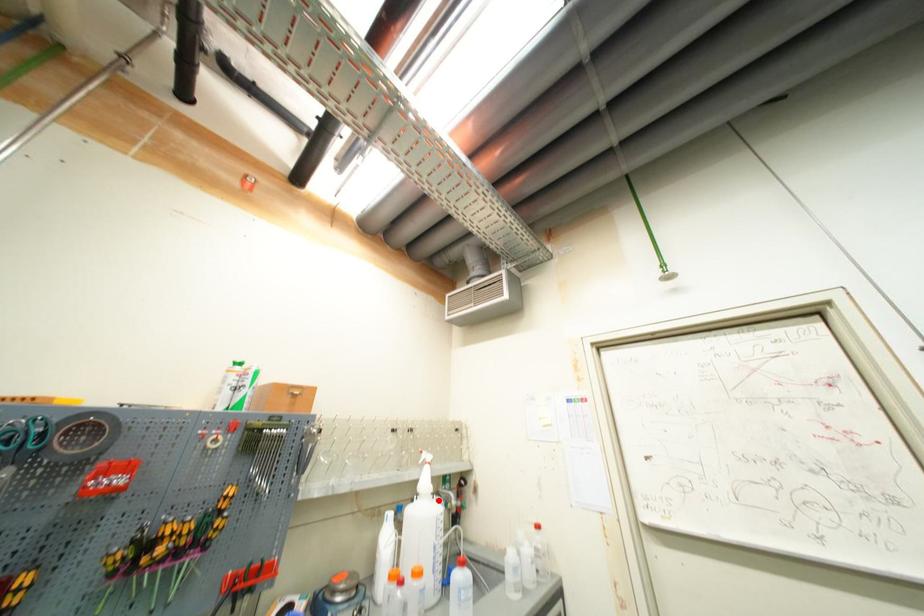
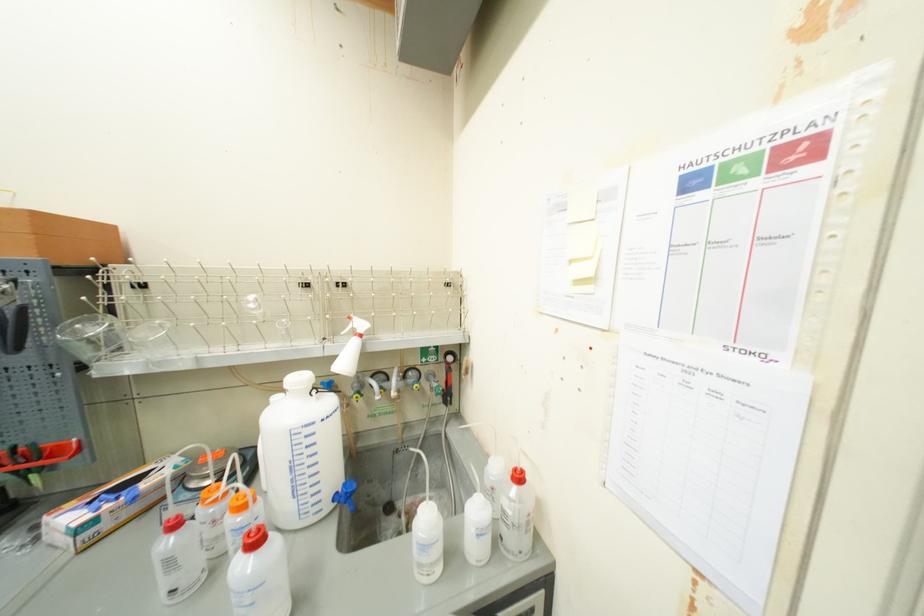
Question: I am providing you with two images of the same scene from different viewpoints. Image1 has a red point marked. In image2, the corresponding 3D location appears at what relative position? Reply with the corresponding letter.

Choices:
 (A) Closer
 (B) Farther

Answer: (A)